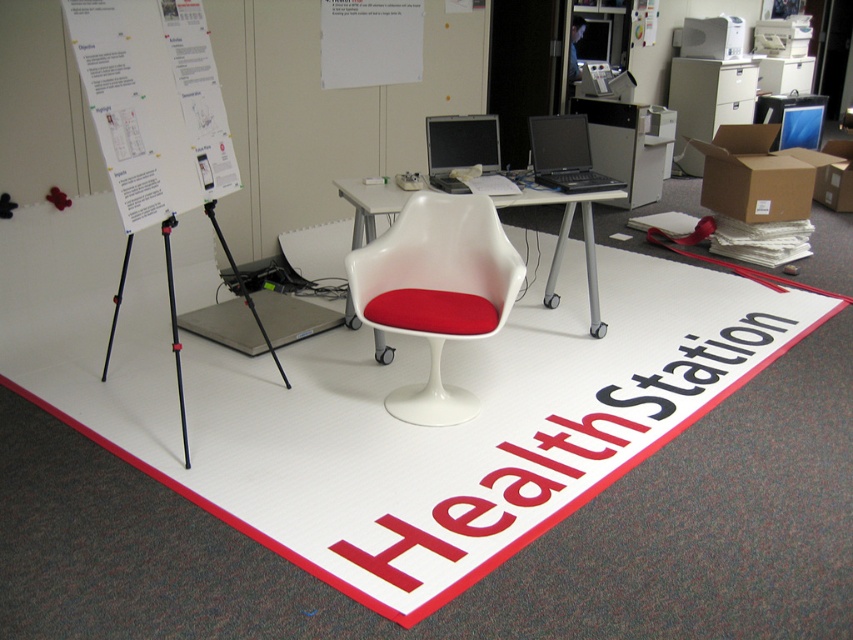
Is white plastic table at center thinner than black glossy laptop at center?

No.

Does point (564, 225) lie behind point (593, 180)?

Yes, it is behind point (593, 180).

Identify the location of white plastic table at center. (566, 237).

Is red vinyl healthstation at center to the left of silver metallic laptop at center from the viewer's perspective?

In fact, red vinyl healthstation at center is to the right of silver metallic laptop at center.

Which is below, red vinyl healthstation at center or silver metallic laptop at center?

red vinyl healthstation at center

Which is in front, point (450, 528) or point (480, 156)?

Point (450, 528) is more forward.

Identify the location of red vinyl healthstation at center. (556, 444).

Who is more forward, (531,496) or (556,150)?

Point (531,496)

Is white vinyl mat at center above black glossy laptop at center?

No.

Who is more forward, (514, 330) or (550, 122)?

Positioned in front is point (550, 122).

Where is `white vinyl mat at center`? Image resolution: width=853 pixels, height=640 pixels. white vinyl mat at center is located at coordinates (415, 426).